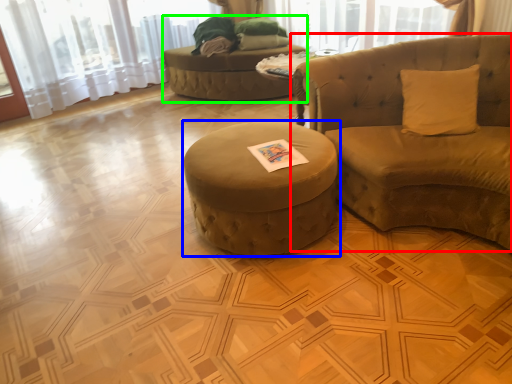
Question: Based on their relative distances, which object is nearer to studio couch (highlighted by a red box)? Choose from table (highlighted by a blue box) and bean bag chair (highlighted by a green box).

Choices:
 (A) table
 (B) bean bag chair

Answer: (A)